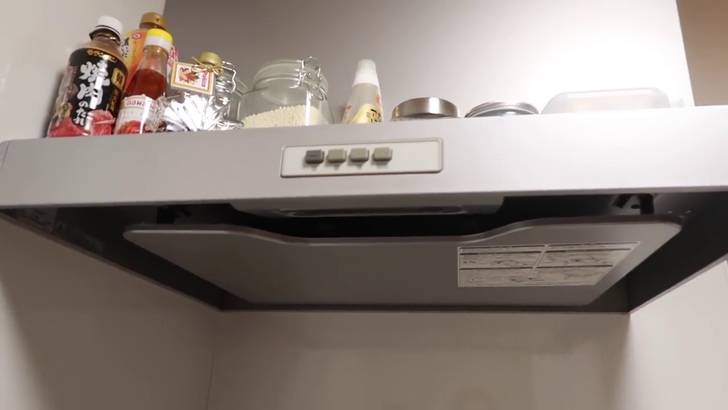
Locate an element on the screen. The image size is (728, 410). empty space above shelf is located at coordinates (418, 32).